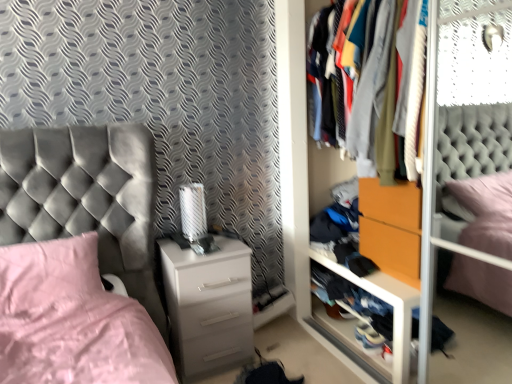
Question: Can textured fabric clothes at center be found inside pink fabric pillow at lower left?

Choices:
 (A) yes
 (B) no

Answer: (B)

Question: Can you confirm if pink fabric pillow at lower left is taller than textured fabric clothes at center?

Choices:
 (A) yes
 (B) no

Answer: (B)

Question: Is pink fabric pillow at lower left closer to the viewer compared to textured fabric clothes at center?

Choices:
 (A) no
 (B) yes

Answer: (A)

Question: Is pink fabric pillow at lower left at the left side of textured fabric clothes at center?

Choices:
 (A) no
 (B) yes

Answer: (B)

Question: From a real-world perspective, does pink fabric pillow at lower left stand above textured fabric clothes at center?

Choices:
 (A) no
 (B) yes

Answer: (A)

Question: From a real-world perspective, is white glossy chest of drawers at center positioned above or below pink fabric pillow at lower left?

Choices:
 (A) above
 (B) below

Answer: (B)

Question: From the image's perspective, is white glossy chest of drawers at center above or below pink fabric pillow at lower left?

Choices:
 (A) below
 (B) above

Answer: (A)

Question: Based on their sizes in the image, would you say white glossy chest of drawers at center is bigger or smaller than pink fabric pillow at lower left?

Choices:
 (A) small
 (B) big

Answer: (B)

Question: Considering the positions of white glossy chest of drawers at center and pink fabric pillow at lower left in the image, is white glossy chest of drawers at center wider or thinner than pink fabric pillow at lower left?

Choices:
 (A) thin
 (B) wide

Answer: (B)

Question: Do you think orange matte drawer at center is within white glossy chest of drawers at center, or outside of it?

Choices:
 (A) outside
 (B) inside

Answer: (A)

Question: Considering the positions of point (403, 276) and point (207, 342), is point (403, 276) closer or farther from the camera than point (207, 342)?

Choices:
 (A) closer
 (B) farther

Answer: (A)

Question: Is orange matte drawer at center in front of or behind white glossy chest of drawers at center in the image?

Choices:
 (A) front
 (B) behind

Answer: (A)

Question: From a real-world perspective, relative to white glossy chest of drawers at center, is orange matte drawer at center vertically above or below?

Choices:
 (A) below
 (B) above

Answer: (B)

Question: From a real-world perspective, is wooden shelf at lower right positioned above or below wooden drawer at right?

Choices:
 (A) below
 (B) above

Answer: (A)

Question: Is wooden shelf at lower right spatially inside wooden drawer at right, or outside of it?

Choices:
 (A) inside
 (B) outside

Answer: (A)